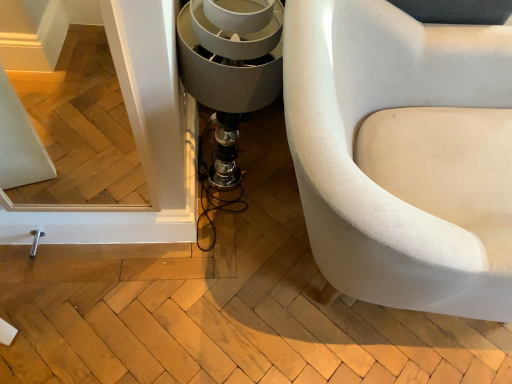
What are the coordinates of `vacant space situated on the left part of white fabric chair at right` in the screenshot? It's located at (153, 254).